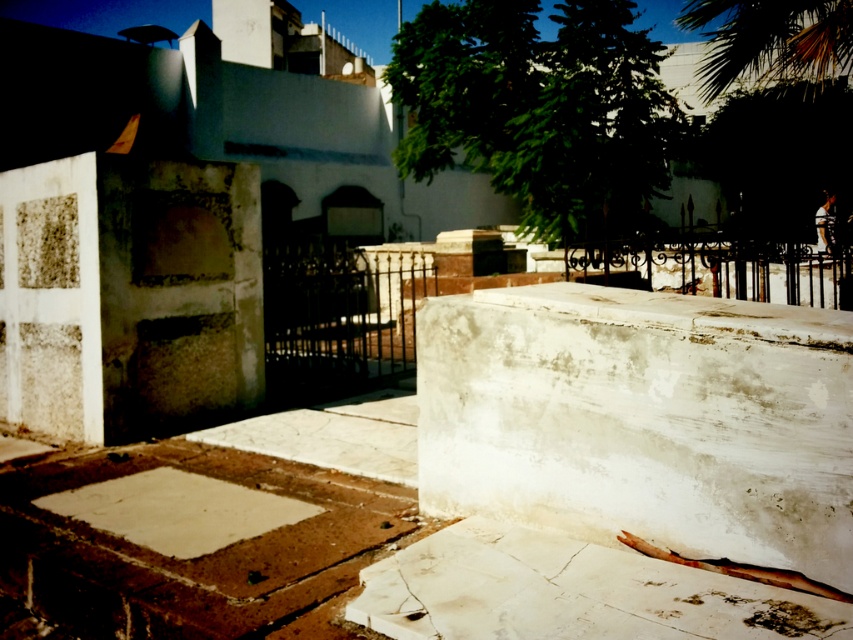
Can you confirm if white marble slab at lower right is shorter than green leafy palm tree at upper right?

Yes, white marble slab at lower right is shorter than green leafy palm tree at upper right.

Between white marble slab at lower right and green leafy palm tree at upper right, which one is positioned lower?

Positioned lower is white marble slab at lower right.

Does point (693, 621) lie in front of point (796, 1)?

Yes, it is in front of point (796, 1).

Locate an element on the screen. white marble slab at lower right is located at coordinates (570, 593).

In the scene shown: Can you confirm if white marble block at center is thinner than white marble slab at lower right?

No, white marble block at center is not thinner than white marble slab at lower right.

Can you confirm if white marble block at center is positioned above white marble slab at lower right?

Indeed, white marble block at center is positioned over white marble slab at lower right.

Who is more forward, (x=796, y=408) or (x=850, y=621)?

Point (x=850, y=621)

Locate an element on the screen. white marble block at center is located at coordinates (643, 419).

Is white marble block at center shorter than green leafy palm tree at upper right?

Correct, white marble block at center is not as tall as green leafy palm tree at upper right.

Which is behind, point (469, 380) or point (764, 13)?

The point (764, 13) is more distant.

Where is `white marble block at center`? white marble block at center is located at coordinates (643, 419).